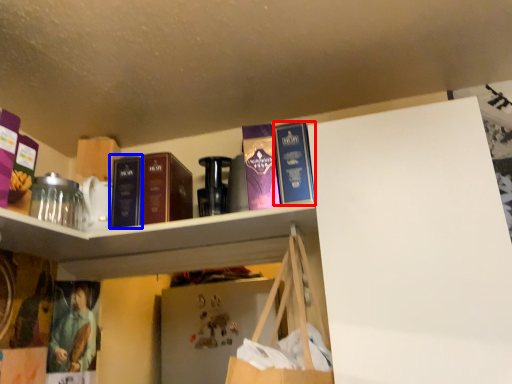
Question: Which object appears closest to the camera in this image, book (highlighted by a red box) or book (highlighted by a blue box)?

Choices:
 (A) book
 (B) book

Answer: (A)